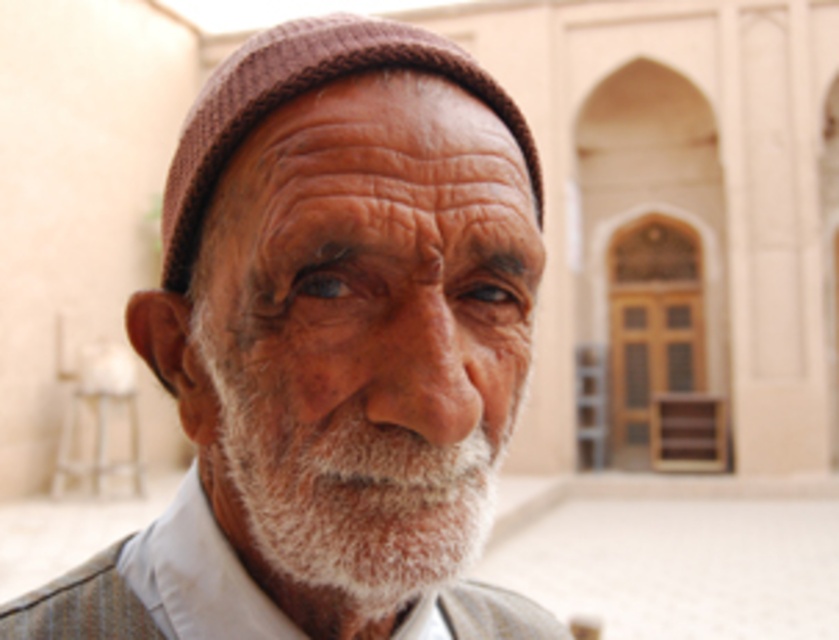
Question: In this image, where is white soft beard at center located relative to knitted brown hat at center?

Choices:
 (A) below
 (B) above

Answer: (A)

Question: Is white woolen cap at center above white soft beard at center?

Choices:
 (A) yes
 (B) no

Answer: (A)

Question: Among these points, which one is farthest from the camera?

Choices:
 (A) (540, 188)
 (B) (268, 557)

Answer: (A)

Question: Estimate the real-world distances between objects in this image. Which object is farther from the white woolen cap at center?

Choices:
 (A) white soft beard at center
 (B) knitted brown hat at center

Answer: (B)

Question: Is the position of white woolen cap at center less distant than that of white soft beard at center?

Choices:
 (A) no
 (B) yes

Answer: (B)

Question: Estimate the real-world distances between objects in this image. Which object is farther from the white woolen cap at center?

Choices:
 (A) white soft beard at center
 (B) knitted brown hat at center

Answer: (B)